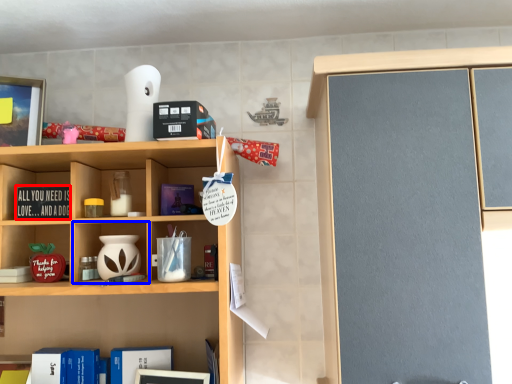
Question: Which point is further to the camera, book (highlighted by a red box) or cabinet (highlighted by a blue box)?

Choices:
 (A) book
 (B) cabinet

Answer: (A)